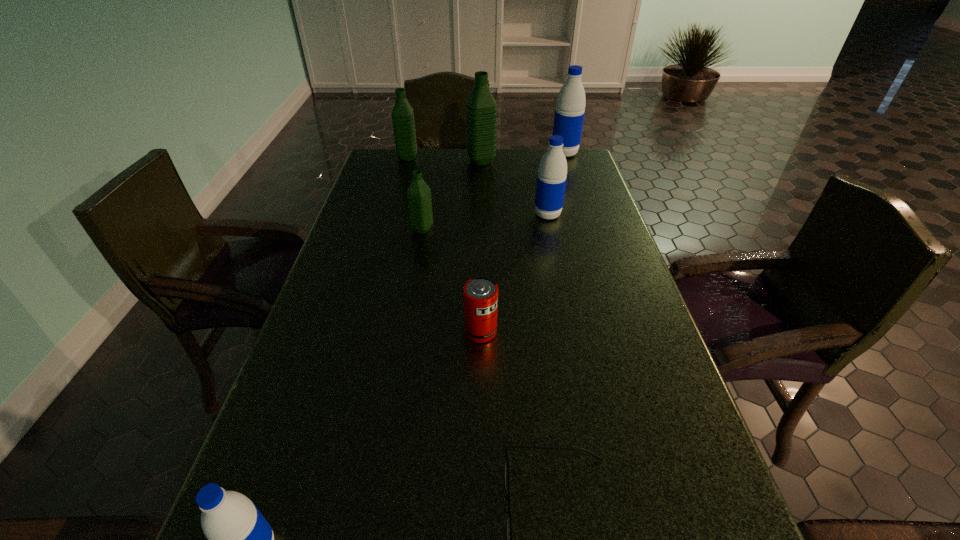
Identify the location of the third nearest object. This screenshot has width=960, height=540. (480, 294).

Locate an element on the screen. The height and width of the screenshot is (540, 960). free spot located on the front of the rightmost blue water bottle is located at coordinates (585, 215).

Find the location of a particular element. The width and height of the screenshot is (960, 540). vacant space situated 0.260m on the right of the rightmost green water bottle is located at coordinates (568, 161).

Image resolution: width=960 pixels, height=540 pixels. In order to click on vacant space situated on the right of the leftmost green water bottle in this screenshot , I will do `click(465, 158)`.

Locate an element on the screen. vacant space located on the left of the second smallest blue water bottle is located at coordinates (440, 215).

Identify the location of vacant region located on the right of the smallest green water bottle. The image size is (960, 540). (466, 230).

Locate an element on the screen. The height and width of the screenshot is (540, 960). vacant point located 0.180m on the right of the second shortest object is located at coordinates (580, 332).

Where is `object at the left edge`? The width and height of the screenshot is (960, 540). object at the left edge is located at coordinates (403, 121).

This screenshot has height=540, width=960. I want to click on object that is at the far left corner, so click(x=403, y=121).

The width and height of the screenshot is (960, 540). What are the coordinates of `object at the far right corner` in the screenshot? It's located at 570,107.